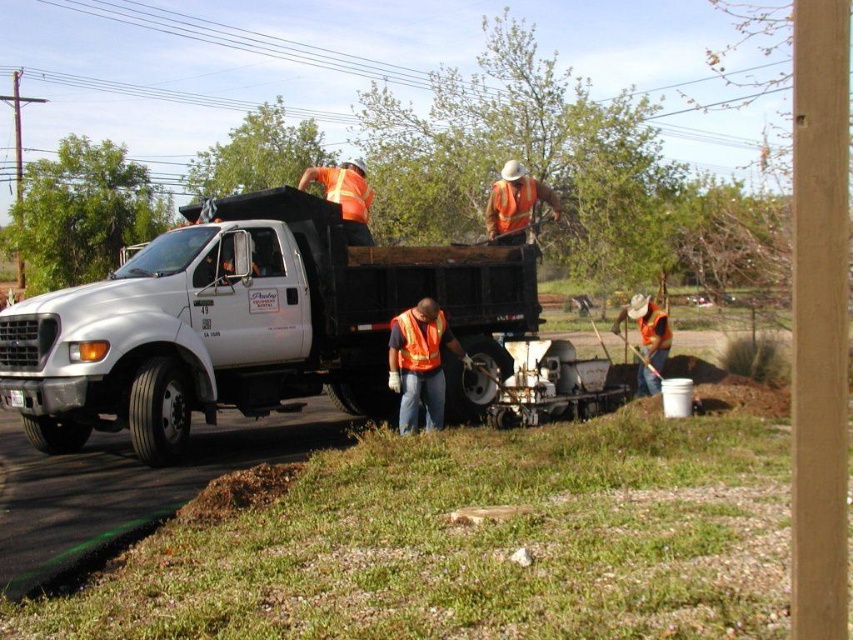
Between point (407, 381) and point (424, 356), which one is positioned in front?

Point (407, 381)

Between reflective orange vest at center and orange reflective safety vest at center, which one is positioned higher?

orange reflective safety vest at center is above.

Which is in front, point (413, 368) or point (410, 365)?

Point (413, 368) is in front.

Image resolution: width=853 pixels, height=640 pixels. In order to click on reflective orange vest at center in this screenshot , I will do `click(421, 364)`.

Between point (157, 292) and point (427, 349), which one is positioned in front?

Point (157, 292) is more forward.

Does white matte truck at center have a lesser height compared to orange reflective safety vest at center?

Yes, white matte truck at center is shorter than orange reflective safety vest at center.

Locate an element on the screen. white matte truck at center is located at coordinates (245, 324).

Does white matte truck at center appear over reflective orange vest at center?

Actually, white matte truck at center is below reflective orange vest at center.

Does point (183, 387) come in front of point (393, 340)?

Yes.

Identify the location of white matte truck at center. This screenshot has width=853, height=640. (245, 324).